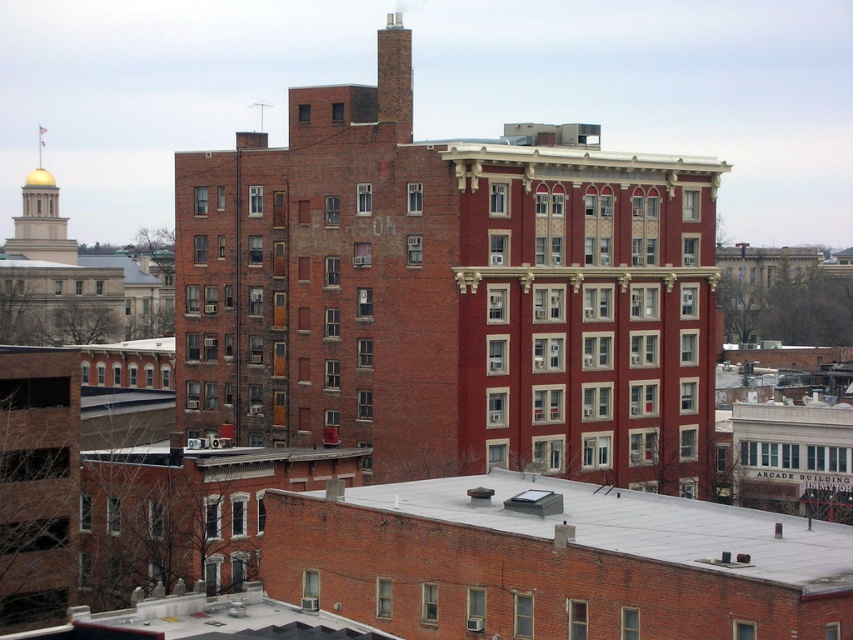
Question: Can you confirm if brick chimney at center is positioned below brick chimney at upper center?

Choices:
 (A) yes
 (B) no

Answer: (A)

Question: Among these points, which one is farthest from the camera?

Choices:
 (A) (677, 243)
 (B) (393, 52)

Answer: (A)

Question: Is brick chimney at center to the left of brick chimney at upper center from the viewer's perspective?

Choices:
 (A) no
 (B) yes

Answer: (A)

Question: Is brick chimney at center to the right of brick chimney at upper center from the viewer's perspective?

Choices:
 (A) no
 (B) yes

Answer: (B)